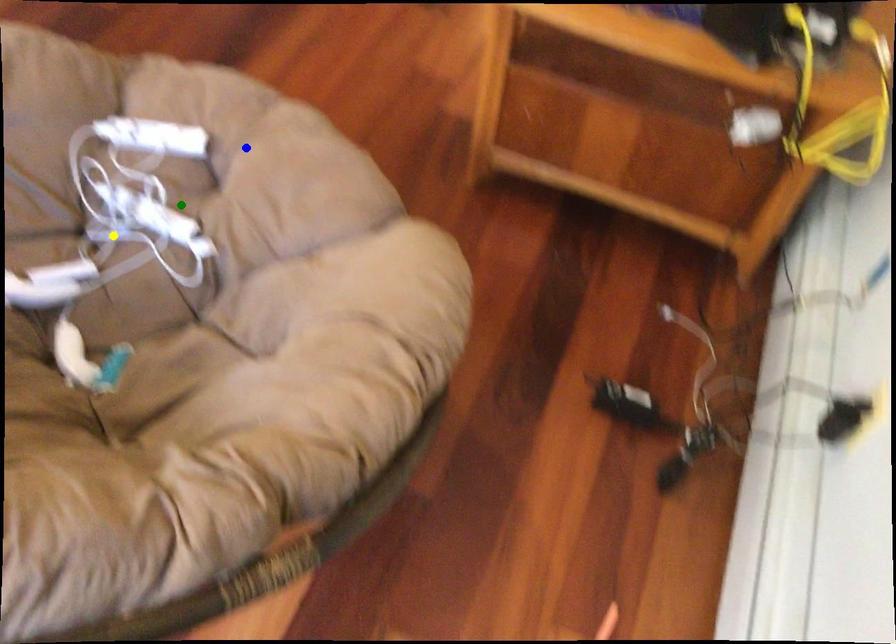
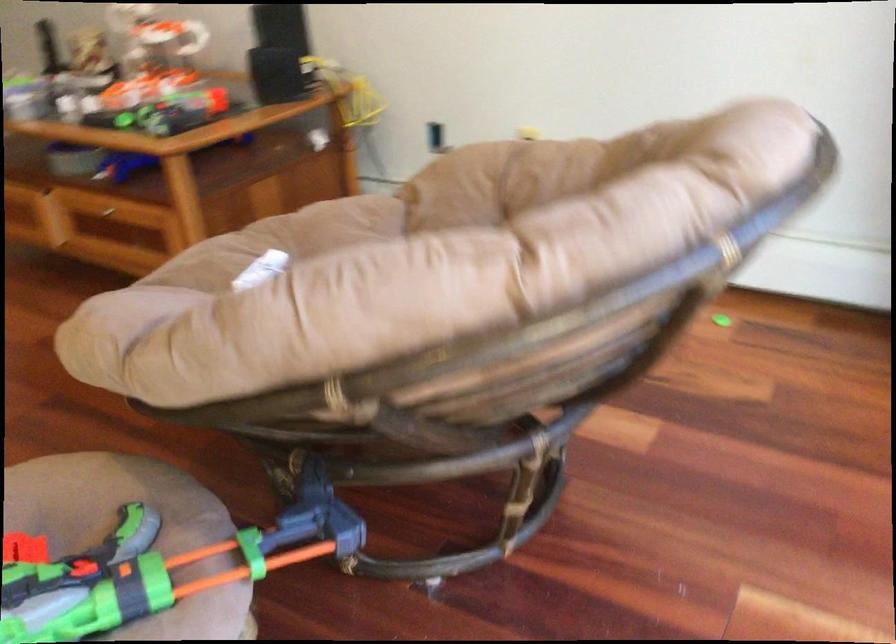
I am providing you with two images of the same scene from different viewpoints. Three points are marked in image1. Which point corresponds to a part or object that is occluded in image2?In image1, three points are marked. Which of them correspond to a part or object that is occluded in image2?Among the three points shown in image1, which one corresponds to a part or object that is no longer visible due to occlusion in image2?

Invisible in image2: green point, yellow point.